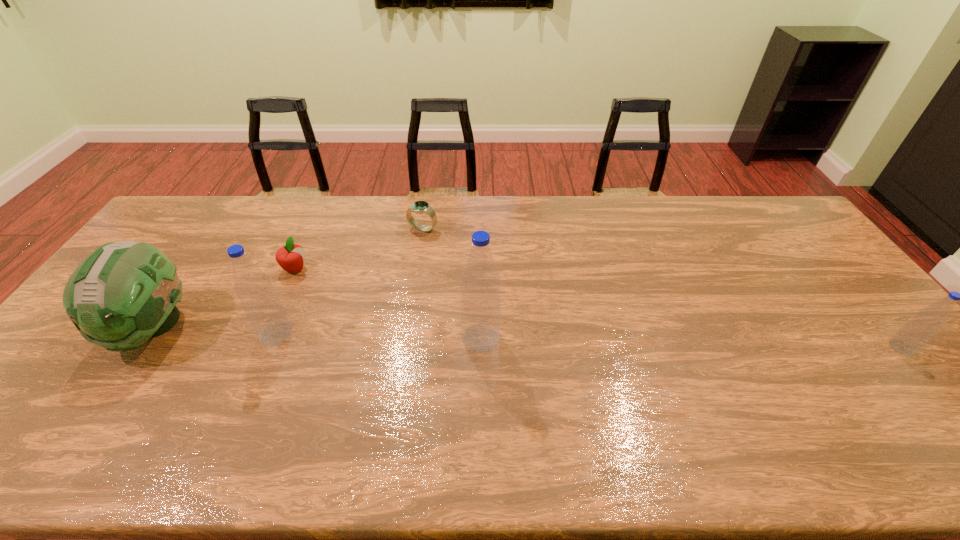
In order to click on vacant area that satisfies the following two spatial constraints: 1. on the back side of the third object from right to left; 2. on the left side of the second farthest object in this screenshot , I will do `click(313, 229)`.

Where is `vacant point that satisfies the following two spatial constraints: 1. on the front side of the rightmost object; 2. on the right side of the second object from right to left`? This screenshot has height=540, width=960. vacant point that satisfies the following two spatial constraints: 1. on the front side of the rightmost object; 2. on the right side of the second object from right to left is located at coordinates (481, 347).